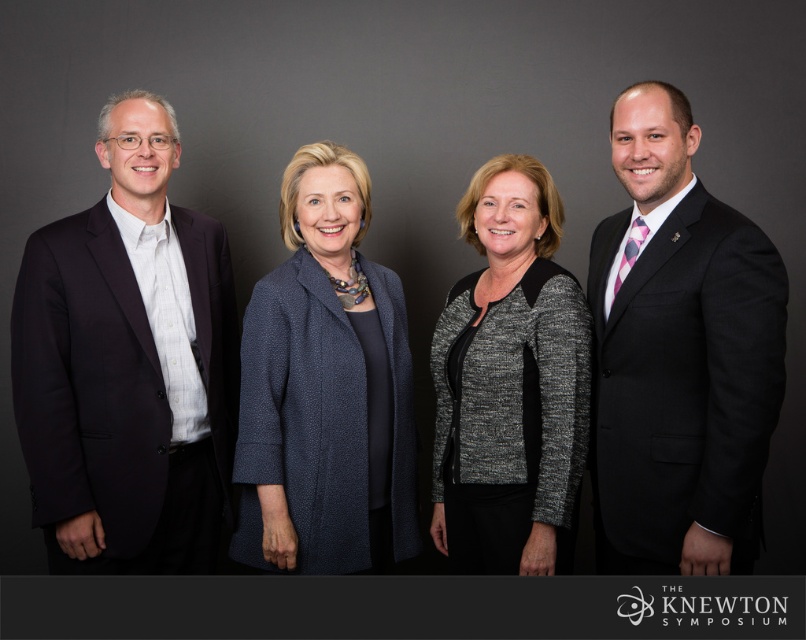
You are standing in front of the group of four people. There are two points marked on the image at coordinates point (226, 384) and point (327, 244). Which point is closer to you?

Point (226, 384) is further to the camera than point (327, 244), so the point closer to you is point (327, 244).

You are a photographer adjusting your camera settings to focus on the subjects in the image. Which of the two, the dark blue suit at left or the blue textured coat at center, should you focus on first to ensure proper depth of field?

The dark blue suit at left is closer to the viewer than the blue textured coat at center, so you should focus on the dark blue suit at left first to ensure proper depth of field.

You are a photographer setting up for a group photo. You need to ensure that the black suit at right and the gray textured blazer at center are positioned correctly according to the scene. Which one is positioned to the right side of the other?

The black suit at right is positioned to the right of the gray textured blazer at center.